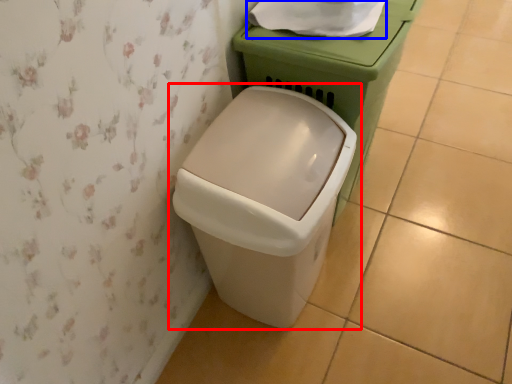
Question: Which of the following is the closest to the observer, waste container (highlighted by a red box) or toilet paper (highlighted by a blue box)?

Choices:
 (A) waste container
 (B) toilet paper

Answer: (A)